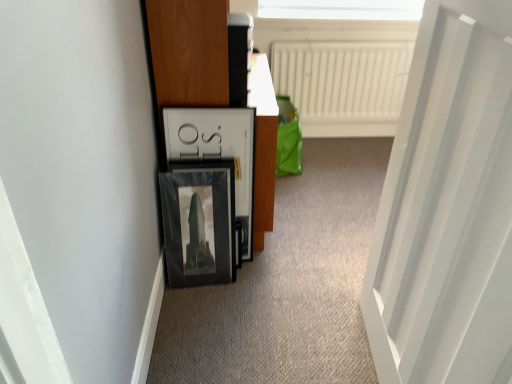
Question: Is wooden dresser at left thinner than white matte radiator at upper center?

Choices:
 (A) yes
 (B) no

Answer: (B)

Question: From a real-world perspective, is wooden dresser at left below white matte radiator at upper center?

Choices:
 (A) no
 (B) yes

Answer: (A)

Question: Considering the relative sizes of wooden dresser at left and white matte radiator at upper center in the image provided, is wooden dresser at left smaller than white matte radiator at upper center?

Choices:
 (A) yes
 (B) no

Answer: (B)

Question: Considering the relative positions of wooden dresser at left and white matte radiator at upper center in the image provided, is wooden dresser at left to the left of white matte radiator at upper center from the viewer's perspective?

Choices:
 (A) yes
 (B) no

Answer: (A)

Question: Is wooden dresser at left wider than white matte radiator at upper center?

Choices:
 (A) no
 (B) yes

Answer: (B)

Question: Is point (496, 216) closer or farther from the camera than point (308, 91)?

Choices:
 (A) farther
 (B) closer

Answer: (B)

Question: In the image, is white smooth door at right positioned in front of or behind white matte radiator at upper center?

Choices:
 (A) front
 (B) behind

Answer: (A)

Question: From the image's perspective, relative to white matte radiator at upper center, is white smooth door at right above or below?

Choices:
 (A) above
 (B) below

Answer: (B)

Question: Based on their sizes in the image, would you say white smooth door at right is bigger or smaller than white matte radiator at upper center?

Choices:
 (A) small
 (B) big

Answer: (B)

Question: From a real-world perspective, is white matte radiator at upper center positioned above or below white smooth door at right?

Choices:
 (A) below
 (B) above

Answer: (A)

Question: From the image's perspective, is white matte radiator at upper center positioned above or below white smooth door at right?

Choices:
 (A) above
 (B) below

Answer: (A)

Question: Is white matte radiator at upper center bigger or smaller than white smooth door at right?

Choices:
 (A) big
 (B) small

Answer: (B)

Question: Does point (380, 44) appear closer or farther from the camera than point (439, 77)?

Choices:
 (A) farther
 (B) closer

Answer: (A)

Question: From their relative heights in the image, would you say wooden dresser at left is taller or shorter than white smooth door at right?

Choices:
 (A) tall
 (B) short

Answer: (B)

Question: Do you think wooden dresser at left is within white smooth door at right, or outside of it?

Choices:
 (A) outside
 (B) inside

Answer: (A)